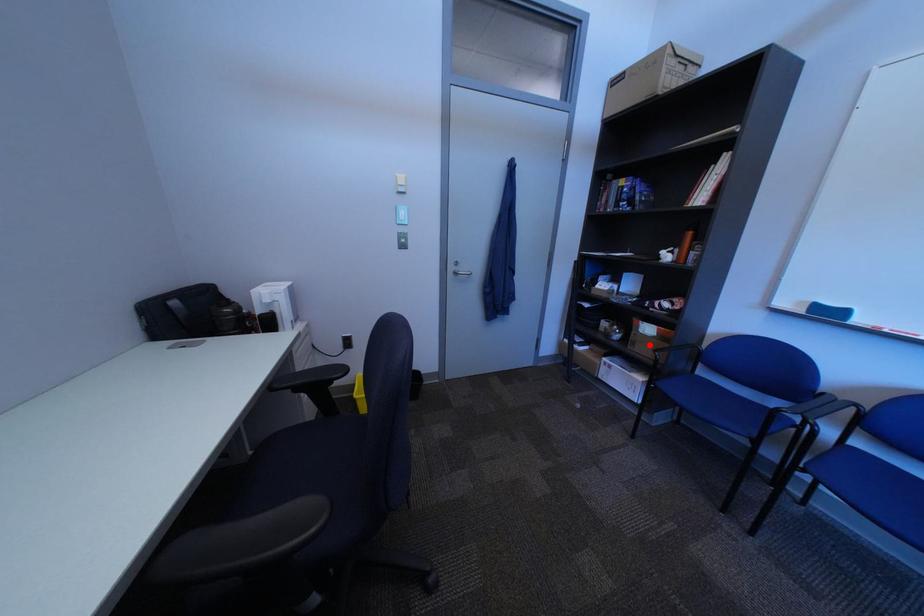
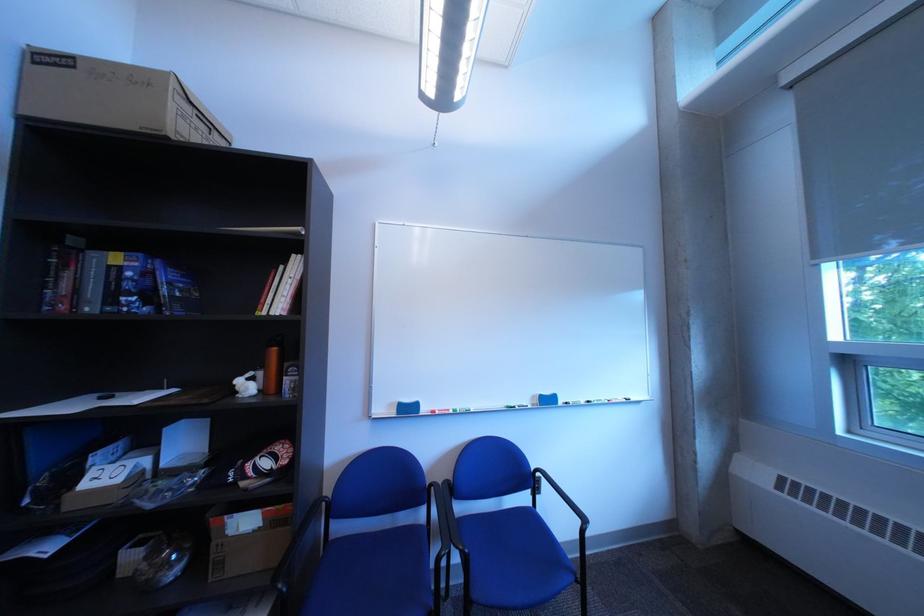
Where in the second image is the point corresponding to the highlighted location from the first image?

(237, 565)